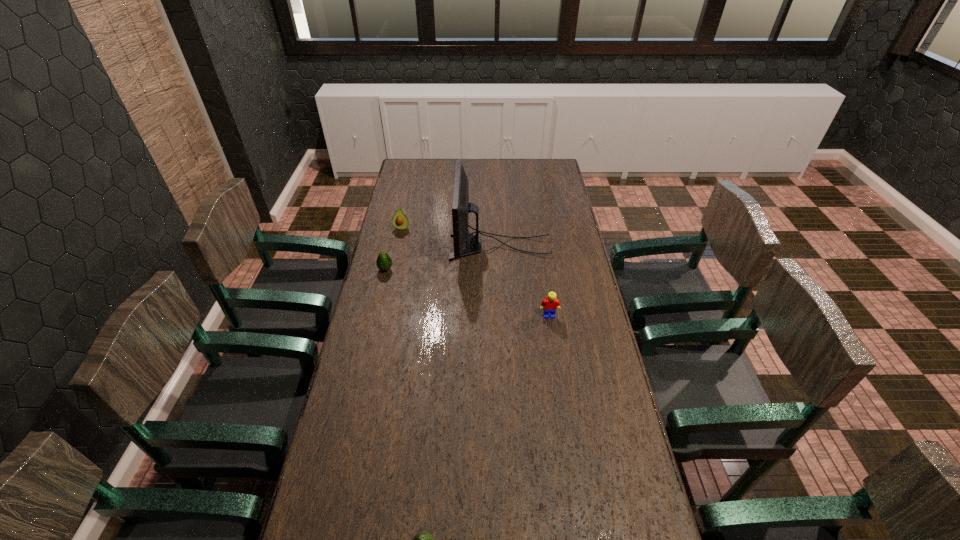
Locate an element on the screen. computer monitor positioned at the right edge is located at coordinates (461, 207).

Identify the location of Lego at the right edge. The width and height of the screenshot is (960, 540). (550, 304).

In the image, there is a desktop. Where is `vacant area at the far edge`? vacant area at the far edge is located at coordinates (513, 176).

The image size is (960, 540). Identify the location of vacant area at the left edge of the desktop. (399, 322).

This screenshot has width=960, height=540. Identify the location of vacant area at the right edge of the desktop. (541, 228).

The image size is (960, 540). I want to click on free point between the second farthest avocado and the Lego, so click(468, 293).

Image resolution: width=960 pixels, height=540 pixels. Identify the location of free space between the tallest object and the second farthest avocado. (443, 258).

Identify the location of unoccupied position between the computer monitor and the tallest avocado. Image resolution: width=960 pixels, height=540 pixels. (450, 237).

The image size is (960, 540). What are the coordinates of `vacant space in between the second farthest avocado and the second nearest object` in the screenshot? It's located at (468, 293).

Identify the location of vacant space in between the computer monitor and the second farthest avocado. (443, 258).